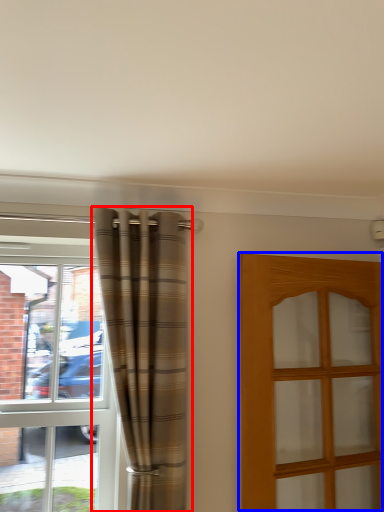
Question: Which of the following is the closest to the observer, curtain (highlighted by a red box) or door (highlighted by a blue box)?

Choices:
 (A) curtain
 (B) door

Answer: (B)